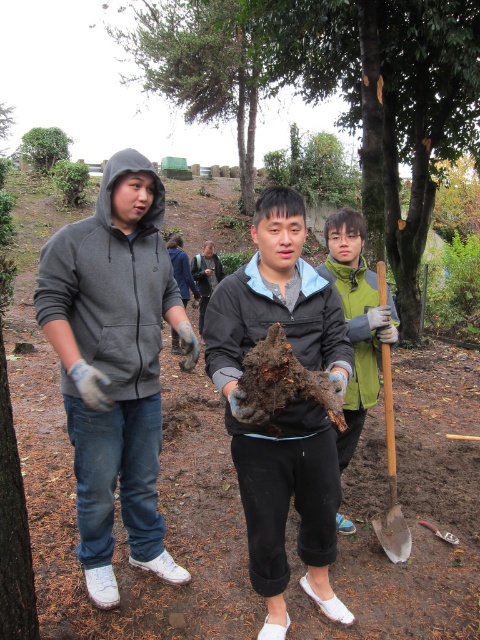
You are a photographer taking a picture of the scene. To ensure the brown soil at center and the green matte jacket at center are both clearly visible, which one should you focus on first?

The brown soil at center is in front of the green matte jacket at center, so you should focus on the brown soil at center first to ensure both are in focus.

You are standing at the center of the image and want to retrieve the wooden shovel at lower right. Which direction should you move to reach it?

You should move to your lower right to reach the wooden shovel at lower right.